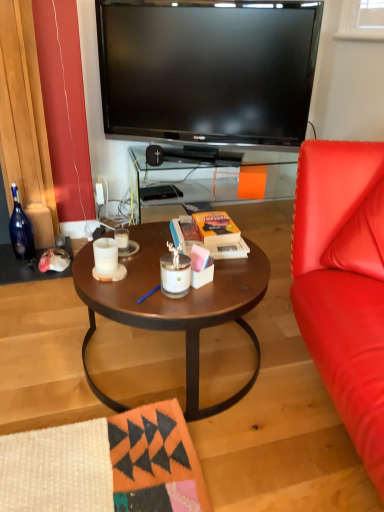
The height and width of the screenshot is (512, 384). What are the coordinates of `free space behind white matte candle at center, which appears as the first coffee cup when viewed from the front` in the screenshot? It's located at (135, 244).